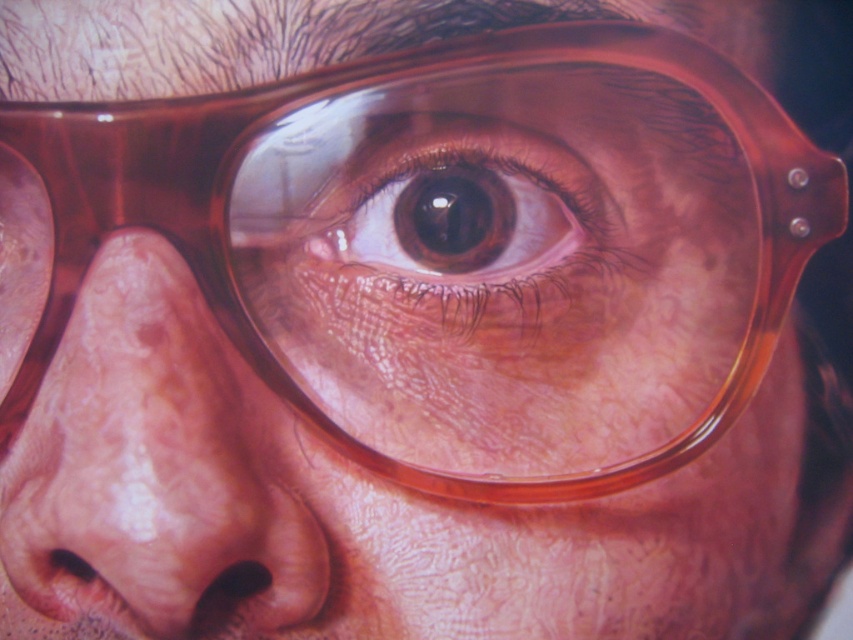
Is matte flesh-toned nose at center smaller than brown glossy eye at center?

No, matte flesh-toned nose at center is not smaller than brown glossy eye at center.

The image size is (853, 640). I want to click on matte flesh-toned nose at center, so click(x=155, y=468).

Is point (221, 396) behind point (625, 282)?

No.

At what (x,y) coordinates should I click in order to perform the action: click on matte flesh-toned nose at center. Please return your answer as a coordinate pair (x, y). The image size is (853, 640). Looking at the image, I should click on (155, 468).